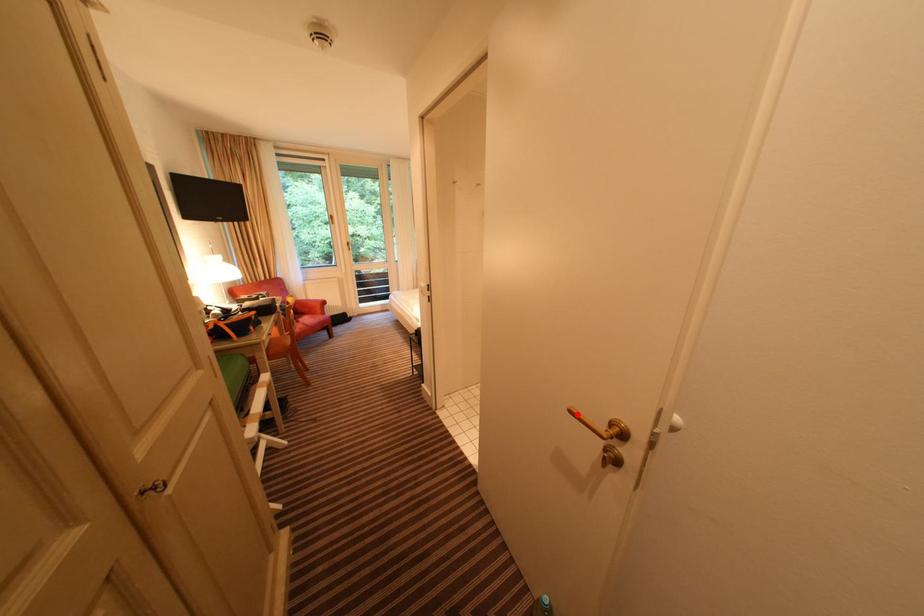
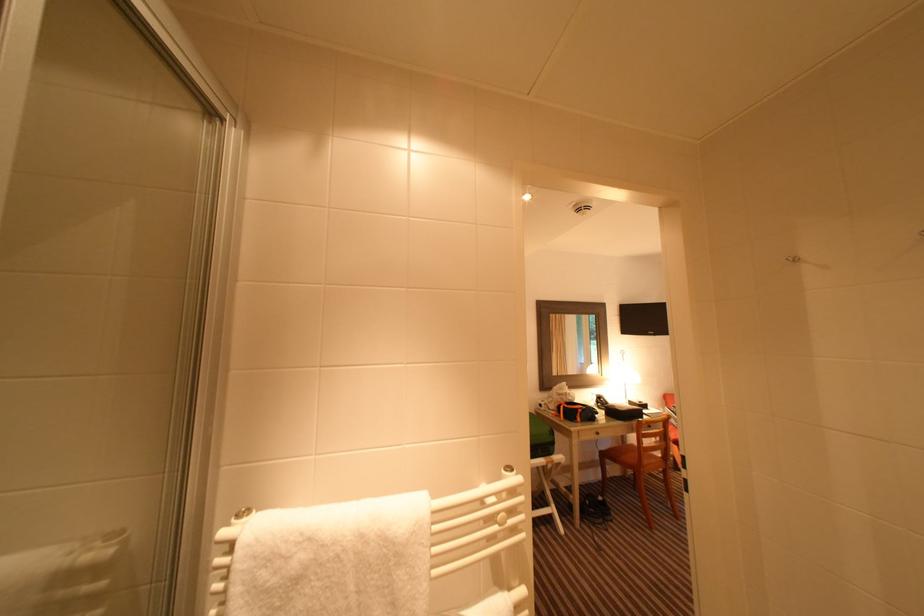
Question: I am providing you with two images of the same scene from different viewpoints. A red point is marked on the first image. Is the red point's position out of view in image 2?

Choices:
 (A) Yes
 (B) No

Answer: (A)